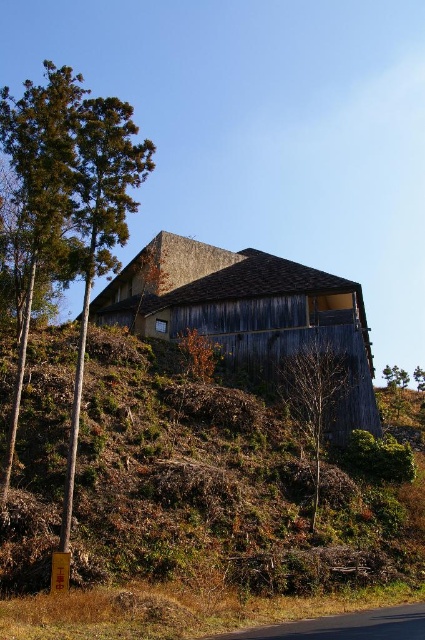
Consider the image. Can you confirm if weathered wood barn at center is wider than bare wood tree at center?

Yes.

Which is behind, point (212, 316) or point (297, 404)?

Positioned behind is point (212, 316).

In order to click on weathered wood barn at center in this screenshot , I will do (248, 312).

Can you confirm if brown wood hillside at center is thinner than bare wood tree at center?

No.

Consider the image. Which is more to the left, brown wood hillside at center or bare wood tree at center?

From the viewer's perspective, brown wood hillside at center appears more on the left side.

Who is more distant from viewer, (37, 573) or (303, 355)?

The point (303, 355) is behind.

The image size is (425, 640). I want to click on brown wood hillside at center, so click(x=223, y=484).

Which is below, brown wood hillside at center or weathered wood barn at center?

brown wood hillside at center is below.

I want to click on brown wood hillside at center, so click(223, 484).

Locate an element on the screen. brown wood hillside at center is located at coordinates (223, 484).